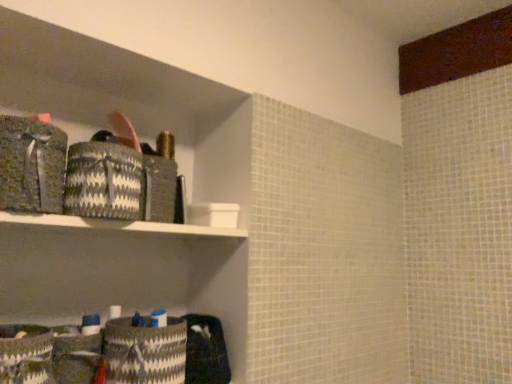
In order to click on textured gray fabric at left, marked as the 1th material in a top-to-bottom arrangement in this screenshot , I will do `click(32, 165)`.

Describe the element at coordinates (119, 225) in the screenshot. This screenshot has width=512, height=384. I see `white plastic shelf at upper center` at that location.

What is the approximate height of black and white woven basket at upper left, which appears as the 2th material when viewed from the top?

black and white woven basket at upper left, which appears as the 2th material when viewed from the top, is 6.10 inches in height.

Image resolution: width=512 pixels, height=384 pixels. Describe the element at coordinates (104, 181) in the screenshot. I see `black and white woven basket at upper left, which appears as the 2th material when ordered from the bottom` at that location.

The height and width of the screenshot is (384, 512). Identify the location of textured gray fabric at left, which ranks as the third material in bottom-to-top order. (32, 165).

Identify the location of shelf that is above the white and black woven basket at lower left, which ranks as the first material in bottom-to-top order (from the image's perspective). (119, 225).

Between point (42, 215) and point (136, 341), which one is positioned in front?

Point (42, 215)

Is white plastic shelf at upper center turned away from white and black woven basket at lower left, which ranks as the first material in bottom-to-top order?

No, white plastic shelf at upper center is not facing the opposite direction of white and black woven basket at lower left, which ranks as the first material in bottom-to-top order.

From the image's perspective, is white plastic shelf at upper center on top of white and black woven basket at lower left, which appears as the 3th material when viewed from the top?

Yes, from the image's perspective, white plastic shelf at upper center is on top of white and black woven basket at lower left, which appears as the 3th material when viewed from the top.

Is white and black woven basket at lower left, which appears as the 3th material when viewed from the top, to the right of textured gray fabric at left, which ranks as the third material in bottom-to-top order, from the viewer's perspective?

Indeed, white and black woven basket at lower left, which appears as the 3th material when viewed from the top, is positioned on the right side of textured gray fabric at left, which ranks as the third material in bottom-to-top order.

Considering the positions of objects white and black woven basket at lower left, which ranks as the first material in bottom-to-top order, and textured gray fabric at left, marked as the 1th material in a top-to-bottom arrangement, in the image provided, who is in front, white and black woven basket at lower left, which ranks as the first material in bottom-to-top order, or textured gray fabric at left, marked as the 1th material in a top-to-bottom arrangement,?

textured gray fabric at left, marked as the 1th material in a top-to-bottom arrangement, is more forward.

Does white and black woven basket at lower left, which ranks as the first material in bottom-to-top order, have a greater height compared to textured gray fabric at left, which ranks as the third material in bottom-to-top order?

Incorrect, the height of white and black woven basket at lower left, which ranks as the first material in bottom-to-top order, is not larger of that of textured gray fabric at left, which ranks as the third material in bottom-to-top order.

Is point (123, 337) positioned after point (14, 151)?

That is True.

In the scene shown: Does black and white woven basket at upper left, which appears as the 2th material when ordered from the bottom, contain white and black woven basket at lower left, which ranks as the first material in bottom-to-top order?

No, white and black woven basket at lower left, which ranks as the first material in bottom-to-top order, is not inside black and white woven basket at upper left, which appears as the 2th material when ordered from the bottom.

From the image's perspective, relative to white and black woven basket at lower left, which ranks as the first material in bottom-to-top order, is black and white woven basket at upper left, which appears as the 2th material when viewed from the top, above or below?

Clearly, from the image's perspective, black and white woven basket at upper left, which appears as the 2th material when viewed from the top, is above white and black woven basket at lower left, which ranks as the first material in bottom-to-top order.

Which object is further away from the camera, black and white woven basket at upper left, which appears as the 2th material when ordered from the bottom, or white and black woven basket at lower left, which ranks as the first material in bottom-to-top order?

white and black woven basket at lower left, which ranks as the first material in bottom-to-top order, is further away from the camera.

Which is more to the left, black and white woven basket at upper left, which appears as the 2th material when ordered from the bottom, or white and black woven basket at lower left, which appears as the 3th material when viewed from the top?

From the viewer's perspective, black and white woven basket at upper left, which appears as the 2th material when ordered from the bottom, appears more on the left side.

Does black and white woven basket at upper left, which appears as the 2th material when viewed from the top, appear on the right side of textured gray fabric at left, marked as the 1th material in a top-to-bottom arrangement?

Correct, you'll find black and white woven basket at upper left, which appears as the 2th material when viewed from the top, to the right of textured gray fabric at left, marked as the 1th material in a top-to-bottom arrangement.

Which of these two, black and white woven basket at upper left, which appears as the 2th material when ordered from the bottom, or textured gray fabric at left, marked as the 1th material in a top-to-bottom arrangement, is wider?

Wider between the two is textured gray fabric at left, marked as the 1th material in a top-to-bottom arrangement.

From a real-world perspective, is black and white woven basket at upper left, which appears as the 2th material when viewed from the top, on textured gray fabric at left, marked as the 1th material in a top-to-bottom arrangement?

Incorrect, from a real-world perspective, black and white woven basket at upper left, which appears as the 2th material when viewed from the top, is lower than textured gray fabric at left, marked as the 1th material in a top-to-bottom arrangement.

Does white and black woven basket at lower left, which appears as the 3th material when viewed from the top, appear on the left side of black and white woven basket at upper left, which appears as the 2th material when viewed from the top?

Incorrect, white and black woven basket at lower left, which appears as the 3th material when viewed from the top, is not on the left side of black and white woven basket at upper left, which appears as the 2th material when viewed from the top.

From a real-world perspective, is white and black woven basket at lower left, which appears as the 3th material when viewed from the top, located beneath black and white woven basket at upper left, which appears as the 2th material when viewed from the top?

Yes.

From the image's perspective, between white and black woven basket at lower left, which ranks as the first material in bottom-to-top order, and black and white woven basket at upper left, which appears as the 2th material when viewed from the top, which one is located above?

From the image's view, black and white woven basket at upper left, which appears as the 2th material when viewed from the top, is above.

Is white plastic shelf at upper center facing away from textured gray fabric at left, marked as the 1th material in a top-to-bottom arrangement?

No, white plastic shelf at upper center is not facing away from textured gray fabric at left, marked as the 1th material in a top-to-bottom arrangement.

Looking at this image, from their relative heights in the image, would you say white plastic shelf at upper center is taller or shorter than textured gray fabric at left, which ranks as the third material in bottom-to-top order?

In the image, white plastic shelf at upper center appears to be shorter than textured gray fabric at left, which ranks as the third material in bottom-to-top order.

Which object is positioned more to the left, white plastic shelf at upper center or textured gray fabric at left, marked as the 1th material in a top-to-bottom arrangement?

From the viewer's perspective, textured gray fabric at left, marked as the 1th material in a top-to-bottom arrangement, appears more on the left side.

Looking at this image, between white plastic shelf at upper center and textured gray fabric at left, which ranks as the third material in bottom-to-top order, which one has larger width?

With larger width is white plastic shelf at upper center.

Which object is wider, textured gray fabric at left, marked as the 1th material in a top-to-bottom arrangement, or black and white woven basket at upper left, which appears as the 2th material when viewed from the top?

With larger width is textured gray fabric at left, marked as the 1th material in a top-to-bottom arrangement.

From the image's perspective, is textured gray fabric at left, marked as the 1th material in a top-to-bottom arrangement, located above or below black and white woven basket at upper left, which appears as the 2th material when ordered from the bottom?

textured gray fabric at left, marked as the 1th material in a top-to-bottom arrangement, is above black and white woven basket at upper left, which appears as the 2th material when ordered from the bottom.

Consider the image. Between textured gray fabric at left, which ranks as the third material in bottom-to-top order, and black and white woven basket at upper left, which appears as the 2th material when viewed from the top, which one has larger size?

textured gray fabric at left, which ranks as the third material in bottom-to-top order, is bigger.

This screenshot has height=384, width=512. What are the coordinates of `material directly beneath the white plastic shelf at upper center (from a real-world perspective)` in the screenshot? It's located at (144, 351).

From a real-world perspective, count 2nd materials upward from the white and black woven basket at lower left, which ranks as the first material in bottom-to-top order, and point to it. Please provide its 2D coordinates.

[(32, 165)]

Estimate the real-world distances between objects in this image. Which object is further from black and white woven basket at upper left, which appears as the 2th material when ordered from the bottom, textured gray fabric at left, which ranks as the third material in bottom-to-top order, or white plastic shelf at upper center?

white plastic shelf at upper center is positioned further to the anchor black and white woven basket at upper left, which appears as the 2th material when ordered from the bottom.

Based on their spatial positions, is textured gray fabric at left, marked as the 1th material in a top-to-bottom arrangement, or black and white woven basket at upper left, which appears as the 2th material when viewed from the top, closer to white plastic shelf at upper center?

black and white woven basket at upper left, which appears as the 2th material when viewed from the top.

Based on their spatial positions, is white and black woven basket at lower left, which appears as the 3th material when viewed from the top, or textured gray fabric at left, marked as the 1th material in a top-to-bottom arrangement, further from white plastic shelf at upper center?

white and black woven basket at lower left, which appears as the 3th material when viewed from the top, lies further to white plastic shelf at upper center than the other object.

Which object lies nearer to the anchor point white and black woven basket at lower left, which ranks as the first material in bottom-to-top order, textured gray fabric at left, marked as the 1th material in a top-to-bottom arrangement, or black and white woven basket at upper left, which appears as the 2th material when viewed from the top?

black and white woven basket at upper left, which appears as the 2th material when viewed from the top.

Consider the image. Based on their spatial positions, is white plastic shelf at upper center or black and white woven basket at upper left, which appears as the 2th material when ordered from the bottom, closer to textured gray fabric at left, which ranks as the third material in bottom-to-top order?

black and white woven basket at upper left, which appears as the 2th material when ordered from the bottom, is positioned closer to the anchor textured gray fabric at left, which ranks as the third material in bottom-to-top order.

Based on the photo, based on their spatial positions, is textured gray fabric at left, marked as the 1th material in a top-to-bottom arrangement, or white plastic shelf at upper center further from white and black woven basket at lower left, which appears as the 3th material when viewed from the top?

textured gray fabric at left, marked as the 1th material in a top-to-bottom arrangement, lies further to white and black woven basket at lower left, which appears as the 3th material when viewed from the top, than the other object.

Considering their positions, is black and white woven basket at upper left, which appears as the 2th material when viewed from the top, positioned further to white plastic shelf at upper center than textured gray fabric at left, which ranks as the third material in bottom-to-top order?

textured gray fabric at left, which ranks as the third material in bottom-to-top order, is positioned further to the anchor white plastic shelf at upper center.

When comparing their distances from black and white woven basket at upper left, which appears as the 2th material when viewed from the top, does white and black woven basket at lower left, which ranks as the first material in bottom-to-top order, or white plastic shelf at upper center seem further?

white and black woven basket at lower left, which ranks as the first material in bottom-to-top order, lies further to black and white woven basket at upper left, which appears as the 2th material when viewed from the top, than the other object.

I want to click on shelf between black and white woven basket at upper left, which appears as the 2th material when viewed from the top, and white and black woven basket at lower left, which appears as the 3th material when viewed from the top, from top to bottom, so click(x=119, y=225).

Where is `shelf located between textured gray fabric at left, which ranks as the third material in bottom-to-top order, and black and white woven basket at upper left, which appears as the 2th material when viewed from the top, in the left-right direction`? shelf located between textured gray fabric at left, which ranks as the third material in bottom-to-top order, and black and white woven basket at upper left, which appears as the 2th material when viewed from the top, in the left-right direction is located at coordinates (119, 225).

Where is `material that lies between textured gray fabric at left, which ranks as the third material in bottom-to-top order, and white and black woven basket at lower left, which ranks as the first material in bottom-to-top order, from top to bottom`? The image size is (512, 384). material that lies between textured gray fabric at left, which ranks as the third material in bottom-to-top order, and white and black woven basket at lower left, which ranks as the first material in bottom-to-top order, from top to bottom is located at coordinates (104, 181).

Find the location of a particular element. This screenshot has width=512, height=384. shelf between textured gray fabric at left, marked as the 1th material in a top-to-bottom arrangement, and white and black woven basket at lower left, which appears as the 3th material when viewed from the top, from top to bottom is located at coordinates (119, 225).